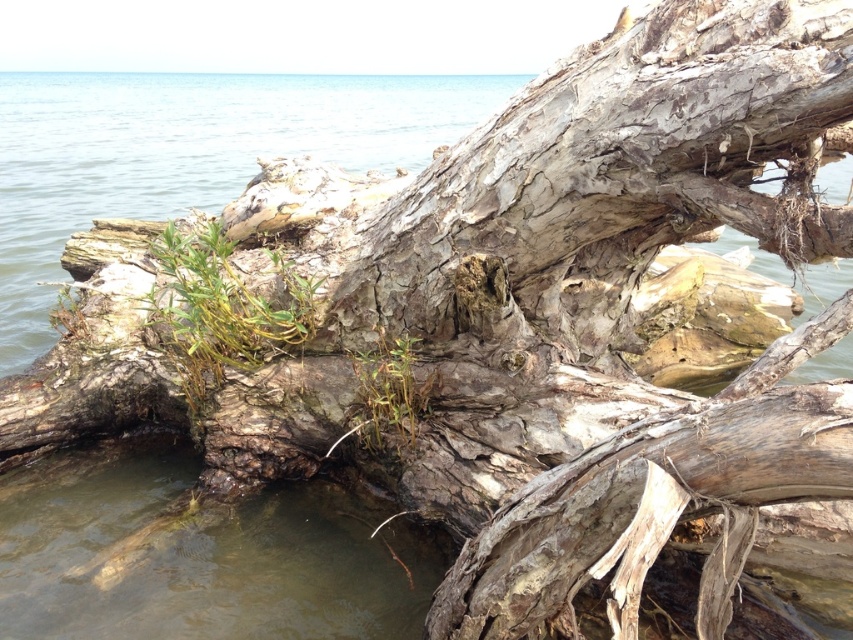
How far apart are green grassy plant at center and green grassy weed at center?

green grassy plant at center and green grassy weed at center are 26.99 inches apart from each other.

Is the position of green grassy plant at center less distant than that of green grassy weed at center?

No, it is behind green grassy weed at center.

At what (x,y) coordinates should I click in order to perform the action: click on green grassy plant at center. Please return your answer as a coordinate pair (x, y). The height and width of the screenshot is (640, 853). Looking at the image, I should click on (219, 308).

Image resolution: width=853 pixels, height=640 pixels. I want to click on green grassy plant at center, so click(219, 308).

Is point (22, 134) positioned after point (202, 269)?

That is True.

Can you confirm if clear water at lower left is positioned to the right of green grassy plant at center?

Incorrect, clear water at lower left is not on the right side of green grassy plant at center.

This screenshot has height=640, width=853. Describe the element at coordinates (187, 154) in the screenshot. I see `clear water at lower left` at that location.

In order to click on clear water at lower left in this screenshot , I will do `click(187, 154)`.

Is clear water at lower left closer to camera compared to green grassy weed at center?

No, it is not.

Can you confirm if clear water at lower left is thinner than green grassy weed at center?

Incorrect, clear water at lower left's width is not less than green grassy weed at center's.

Does point (25, 276) come closer to viewer compared to point (387, 374)?

No, it is behind (387, 374).

Find the location of a particular element. clear water at lower left is located at coordinates tap(187, 154).